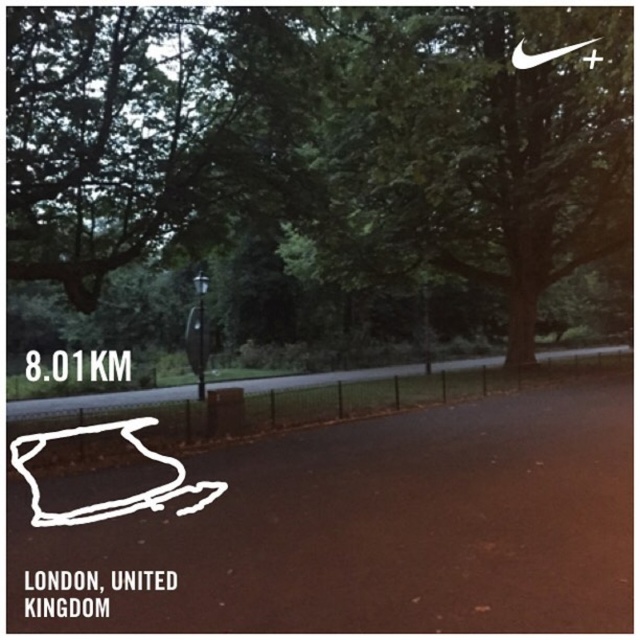
You are a park visitor holding a 2 meter long banner. You want to hang it between the green leafy tree at center and the metallic pole at center. Can the banner fit between them?

The green leafy tree at center is bigger than metallic pole at center, but the banner is 2 meters long. Since the size difference between the tree and pole doesn not provide information about the distance between them, it is unclear if the banner will fit. More information about the distance between the two objects is needed.